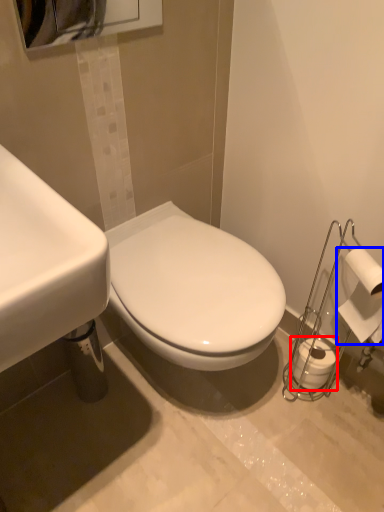
Question: Among these objects, which one is farthest to the camera, toilet paper (highlighted by a red box) or toilet paper (highlighted by a blue box)?

Choices:
 (A) toilet paper
 (B) toilet paper

Answer: (A)